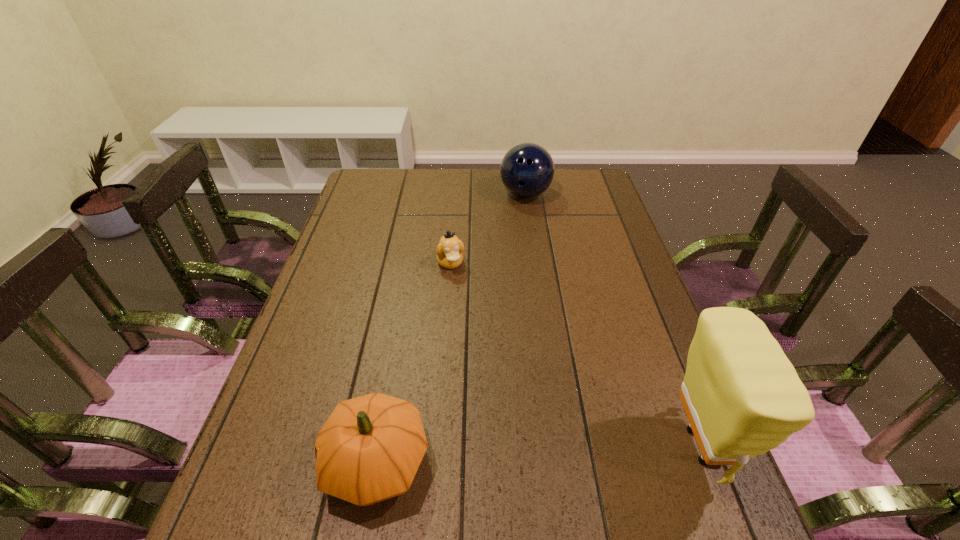
What are the coordinates of `free space between the tallest object and the third object from left to right` in the screenshot? It's located at (613, 320).

This screenshot has height=540, width=960. What are the coordinates of `free space between the shortest object and the gourd` in the screenshot? It's located at (414, 363).

Find the location of a particular element. free space that is in between the farthest object and the sponge is located at coordinates (613, 320).

I want to click on empty space that is in between the farthest object and the rightmost object, so [613, 320].

Locate an element on the screen. free space between the shortest object and the gourd is located at coordinates (414, 363).

At what (x,y) coordinates should I click in order to perform the action: click on free spot between the rightmost object and the duckling. Please return your answer as a coordinate pair (x, y). The height and width of the screenshot is (540, 960). Looking at the image, I should click on (576, 355).

The image size is (960, 540). In order to click on vacant space that's between the bowling ball and the duckling in this screenshot , I will do `click(488, 229)`.

At what (x,y) coordinates should I click in order to perform the action: click on unoccupied position between the shortest object and the farthest object. Please return your answer as a coordinate pair (x, y). This screenshot has height=540, width=960. Looking at the image, I should click on point(488,229).

Locate an element on the screen. This screenshot has width=960, height=540. object identified as the closest to the sponge is located at coordinates (370, 448).

Identify the location of the second closest object to the bowling ball. This screenshot has width=960, height=540. tap(742, 396).